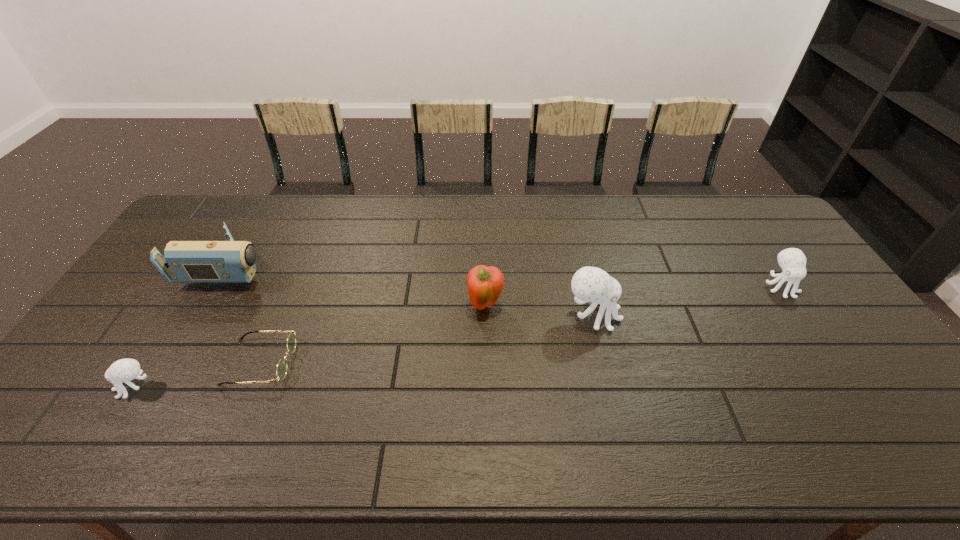
Please determine a free point for an extra octopus_(food) to ensure balance. Please provide its 2D coordinates. Your answer should be formatted as a tuple, i.e. [(x, y)], where the tuple contains the x and y coordinates of a point satisfying the conditions above.

[(379, 348)]